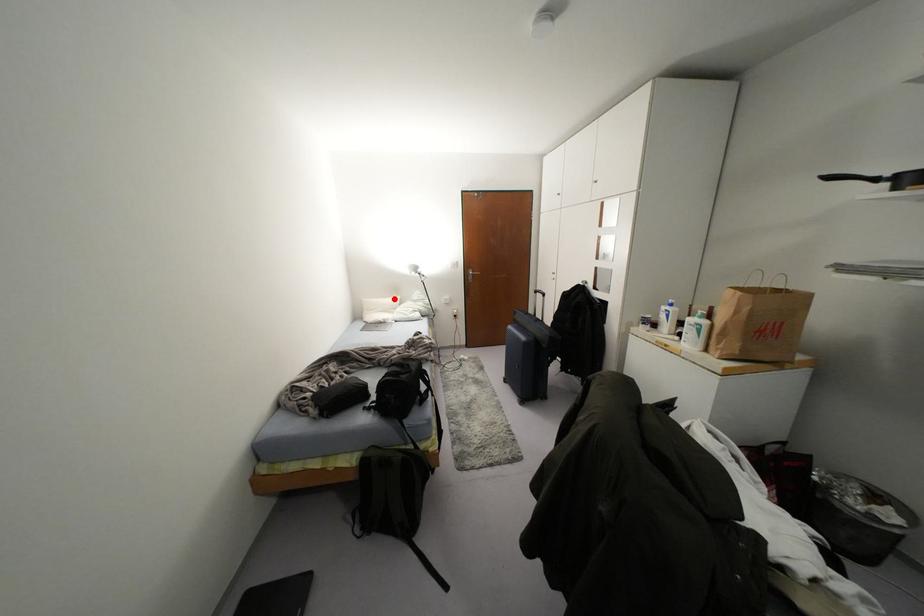
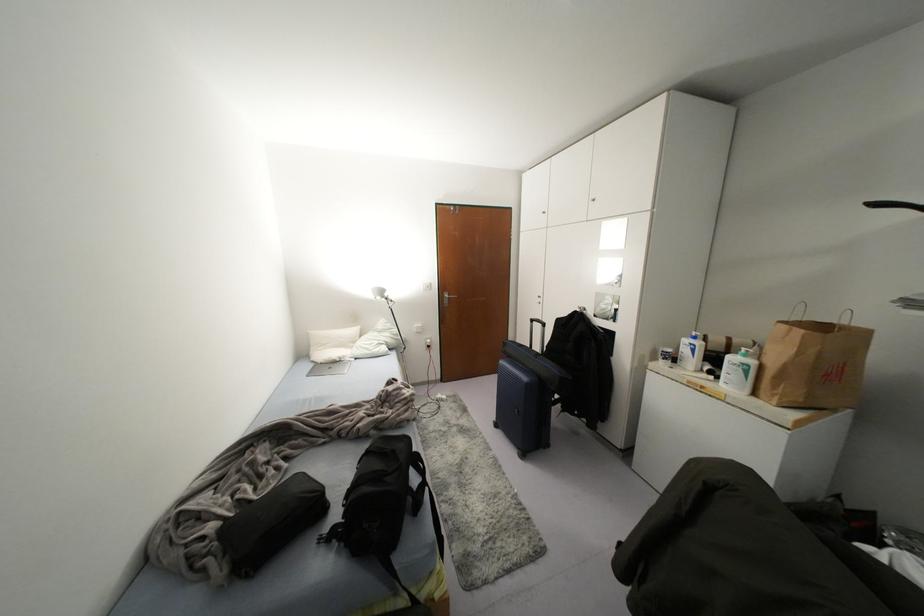
Question: I am providing you with two images of the same scene from different viewpoints. In image1, a red point is highlighted. Considering the same 3D point in image2, which of the following is correct?

Choices:
 (A) It is closer
 (B) It is farther

Answer: (B)